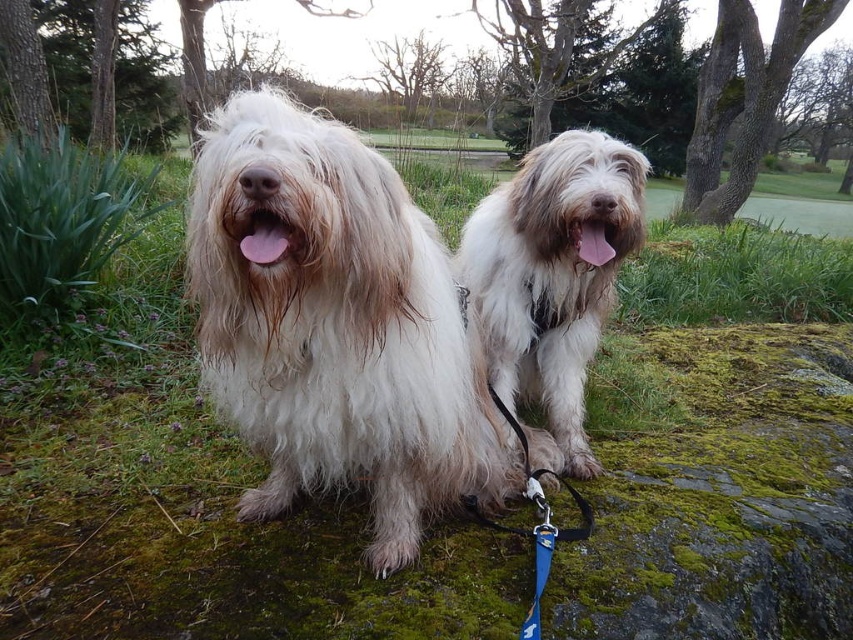
Question: Which point is farther from the camera taking this photo?

Choices:
 (A) (310, 163)
 (B) (563, 221)

Answer: (B)

Question: Does fuzzy white dog at center appear on the left side of blue fabric leash at center?

Choices:
 (A) no
 (B) yes

Answer: (A)

Question: Can you confirm if white fluffy dog at center is positioned above blue fabric leash at center?

Choices:
 (A) yes
 (B) no

Answer: (B)

Question: Which of the following is the closest to the observer?

Choices:
 (A) fuzzy white dog at center
 (B) blue fabric leash at center
 (C) white fluffy dog at center

Answer: (C)

Question: Which point is farther from the camera taking this photo?

Choices:
 (A) (601, 147)
 (B) (541, 296)
 (C) (222, 298)

Answer: (B)

Question: Is white fluffy dog at center smaller than blue fabric leash at center?

Choices:
 (A) no
 (B) yes

Answer: (A)